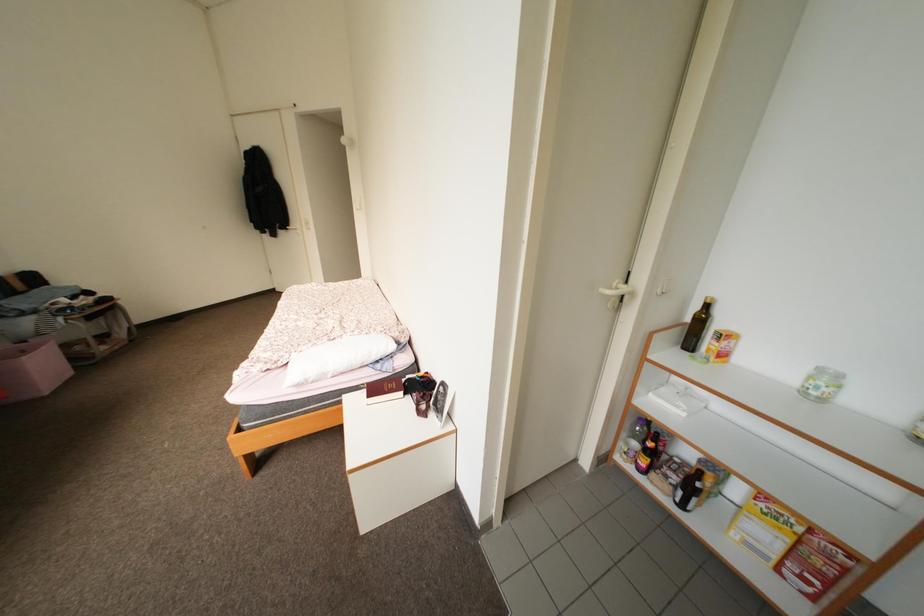
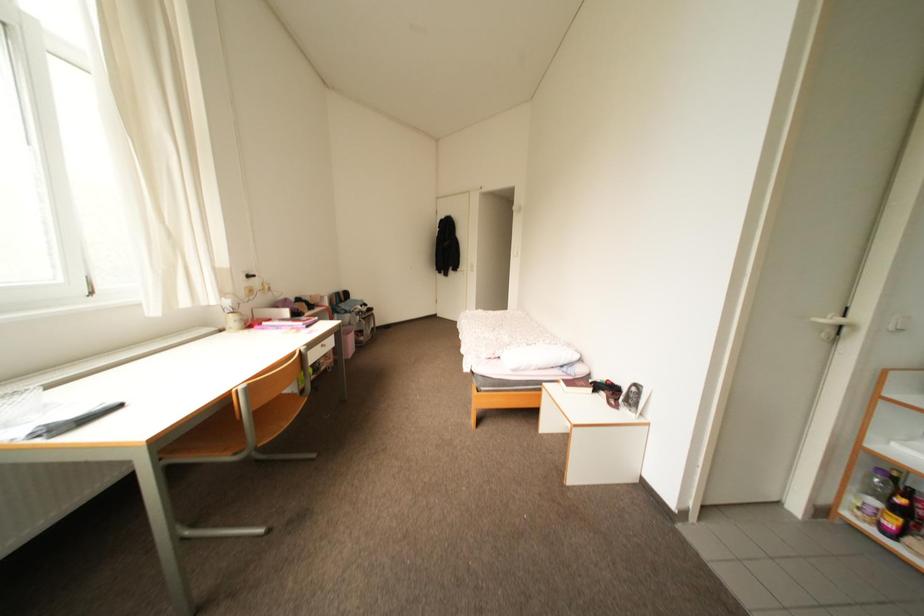
Question: The camera is either moving clockwise (left) or counter-clockwise (right) around the object. The first image is from the beginning of the video and the second image is from the end. Is the camera moving left or right when shooting the video?

Choices:
 (A) Left
 (B) Right

Answer: (B)